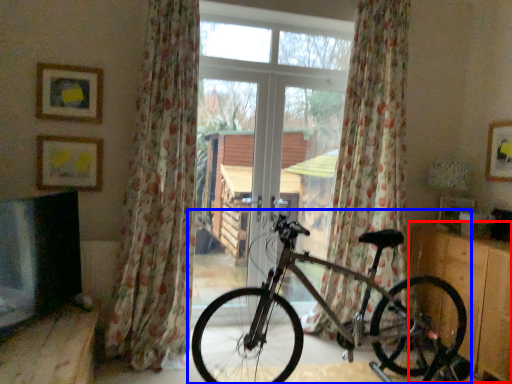
Question: Which point is further to the camera, dresser (highlighted by a red box) or bicycle (highlighted by a blue box)?

Choices:
 (A) dresser
 (B) bicycle

Answer: (A)